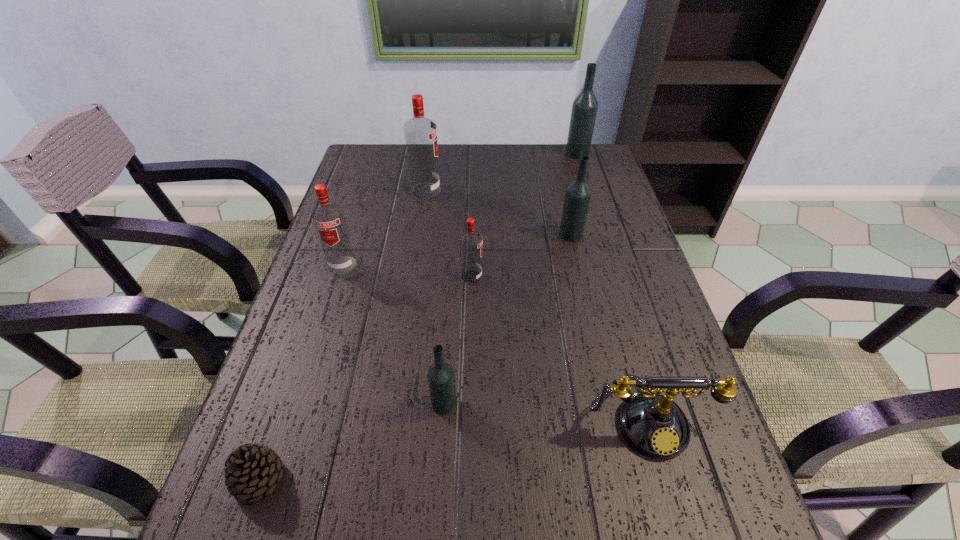
Image resolution: width=960 pixels, height=540 pixels. I want to click on vacant space at the far right corner of the desktop, so click(600, 156).

Where is `vacant area that lies between the black telephone and the pinecone`? The height and width of the screenshot is (540, 960). vacant area that lies between the black telephone and the pinecone is located at coordinates (452, 448).

The width and height of the screenshot is (960, 540). What are the coordinates of `free space between the second vodka from right to left and the second red vodka from left to right` in the screenshot? It's located at (498, 212).

Identify the location of free space that is in between the smallest black vodka and the telephone. The height and width of the screenshot is (540, 960). (544, 410).

Locate an element on the screen. The image size is (960, 540). empty space that is in between the second farthest black vodka and the black telephone is located at coordinates (609, 326).

The height and width of the screenshot is (540, 960). In order to click on free space between the leftmost vodka and the fifth vodka from left to right in this screenshot , I will do click(457, 249).

You are a GUI agent. You are given a task and a screenshot of the screen. Output one action in this format:
    pyautogui.click(x=<x>, y=<y>)
    Task: Click on the free space between the telephone and the seventh nearest object
    This screenshot has width=960, height=540.
    Given the screenshot: What is the action you would take?
    pyautogui.click(x=536, y=304)

I want to click on free space between the telephone and the rightmost red vodka, so click(559, 347).

Identify the location of vacant area between the shortest object and the second biggest red vodka. (300, 372).

Where is `empty space between the second nearest black vodka and the shortest object`? This screenshot has height=540, width=960. empty space between the second nearest black vodka and the shortest object is located at coordinates (415, 356).